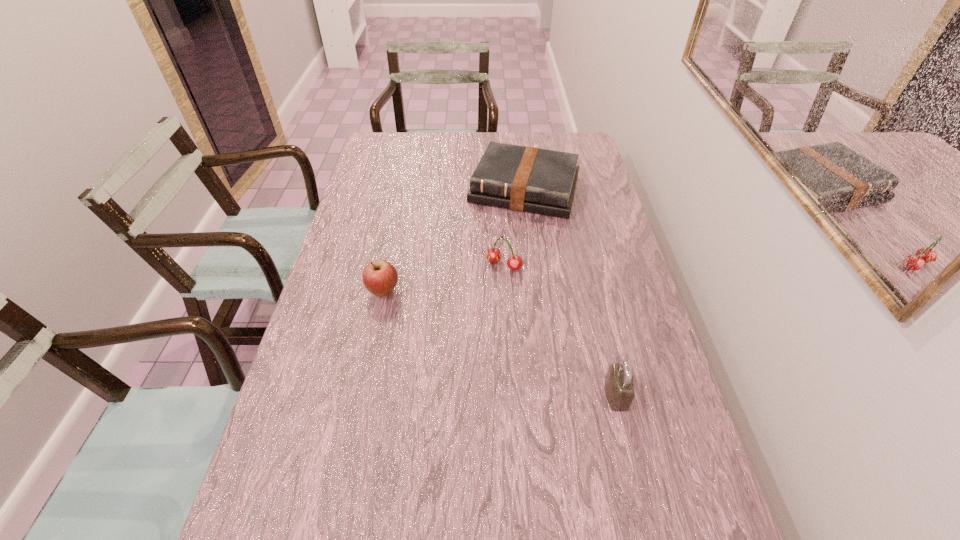
At what (x,y) coordinates should I click in order to perform the action: click on free space on the desktop that is between the leftmost object and the padlock and is positioned with stems pointing upwards on the cherry. Please return your answer as a coordinate pair (x, y). Image resolution: width=960 pixels, height=540 pixels. Looking at the image, I should click on (459, 325).

You are a GUI agent. You are given a task and a screenshot of the screen. Output one action in this format:
    pyautogui.click(x=<x>, y=<y>)
    Task: Click on the free spot on the desktop that is between the apple and the padlock and is positioned on the spine side of the shortest object
    The height and width of the screenshot is (540, 960).
    Given the screenshot: What is the action you would take?
    pyautogui.click(x=476, y=332)